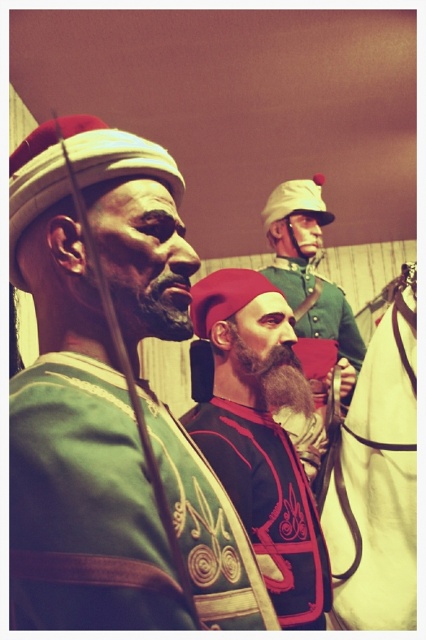
Does velvet red beret at center appear over green velvet uniform at center?

Actually, velvet red beret at center is below green velvet uniform at center.

Does point (313, 538) lie in front of point (296, 241)?

Yes, point (313, 538) is in front of point (296, 241).

The width and height of the screenshot is (426, 640). In order to click on velvet red beret at center in this screenshot , I will do coord(261,436).

Does white matte horse at right have a smaller size compared to dark brown thick beard at center?

Incorrect, white matte horse at right is not smaller in size than dark brown thick beard at center.

Between white matte horse at right and dark brown thick beard at center, which one is positioned higher?

dark brown thick beard at center is higher up.

Is point (400, 506) behind point (302, 378)?

Yes, point (400, 506) is farther from viewer.

You are a GUI agent. You are given a task and a screenshot of the screen. Output one action in this format:
    pyautogui.click(x=<x>, y=<y>)
    Task: Click on the white matte horse at right
    Image resolution: width=426 pixels, height=640 pixels.
    Given the screenshot: What is the action you would take?
    pyautogui.click(x=377, y=481)

Is green matte uniform at center further to camera compared to white matte horse at right?

No, green matte uniform at center is in front of white matte horse at right.

Does green matte uniform at center appear under white matte horse at right?

No.

Is point (155, 192) closer to viewer compared to point (354, 417)?

Yes, it is.

At what (x,y) coordinates should I click in order to perform the action: click on green matte uniform at center. Please return your answer as a coordinate pair (x, y). Looking at the image, I should click on (74, 435).